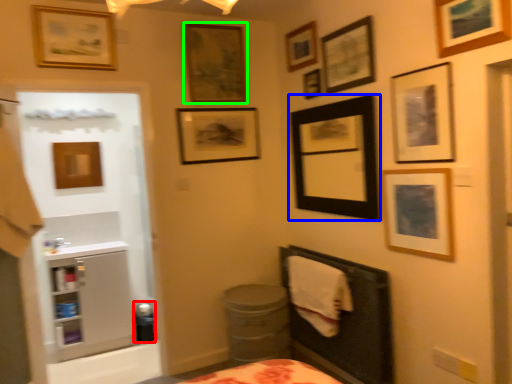
Question: Which object is positioned farthest from potty (highlighted by a red box)? Select from picture frame (highlighted by a blue box) and picture frame (highlighted by a green box).

Choices:
 (A) picture frame
 (B) picture frame

Answer: (B)